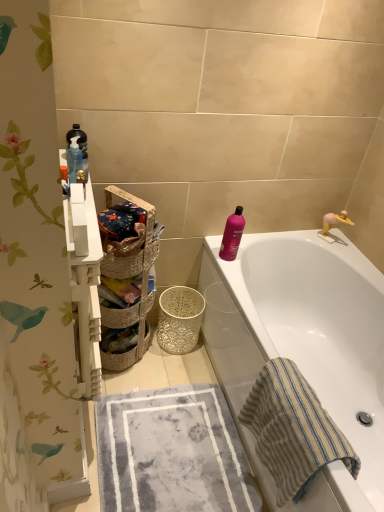
At what (x,y) coordinates should I click in order to perform the action: click on vacant space to the right of woven beige basket at left. Please return your answer as a coordinate pair (x, y). Looking at the image, I should click on (168, 368).